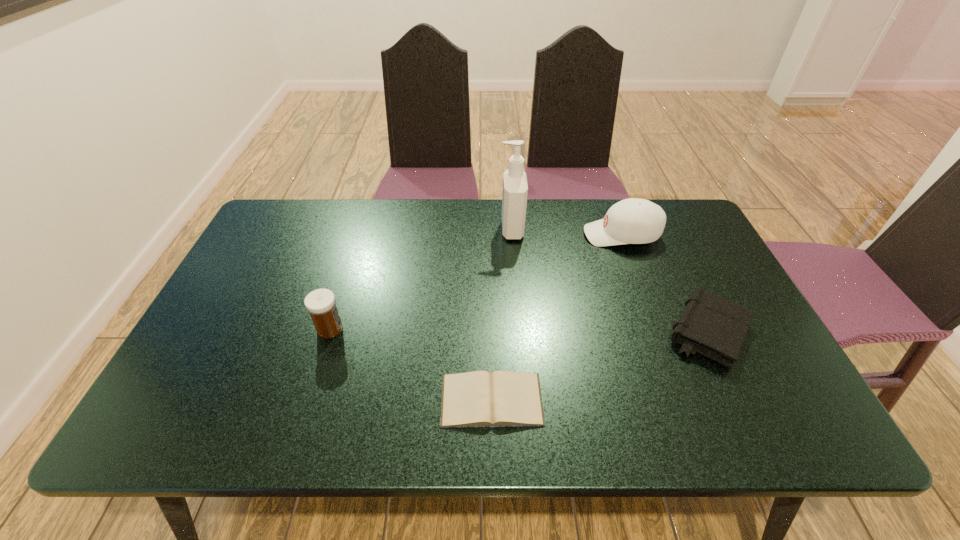
Find the location of a particular element. Bible present at the right edge is located at coordinates (715, 327).

You are a GUI agent. You are given a task and a screenshot of the screen. Output one action in this format:
    pyautogui.click(x=<x>, y=<y>)
    Task: Click on the object present at the far right corner
    Image resolution: width=960 pixels, height=540 pixels.
    Given the screenshot: What is the action you would take?
    point(631,221)

This screenshot has width=960, height=540. Identify the location of free space at the far edge of the desktop. (533, 233).

The image size is (960, 540). In the image, there is a desktop. Identify the location of vacant space at the right edge. (785, 381).

You are a GUI agent. You are given a task and a screenshot of the screen. Output one action in this format:
    pyautogui.click(x=<x>, y=<y>)
    Task: Click on the vacant space at the near left corner of the desktop
    The image size is (960, 540).
    Given the screenshot: What is the action you would take?
    pyautogui.click(x=220, y=416)

This screenshot has width=960, height=540. In order to click on vacant region at the far right corner of the desktop in this screenshot , I will do `click(661, 205)`.

At what (x,y) coordinates should I click in order to perform the action: click on blank space at the near right corner of the desktop. Please return your answer as a coordinate pair (x, y). Looking at the image, I should click on (760, 432).

The height and width of the screenshot is (540, 960). Identify the location of free space that is in between the tallest object and the fourth tallest object. (610, 281).

Find the location of `unoccupied position between the nearer Bible and the right Bible`. unoccupied position between the nearer Bible and the right Bible is located at coordinates (600, 366).

Find the location of a particular element. The width and height of the screenshot is (960, 540). free space between the left Bible and the baseball cap is located at coordinates (557, 317).